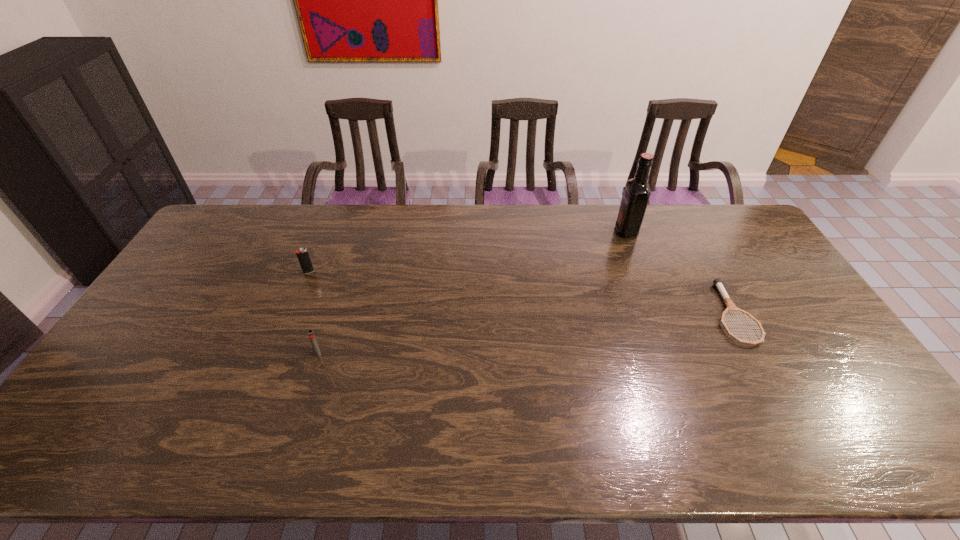
You are a GUI agent. You are given a task and a screenshot of the screen. Output one action in this format:
    pyautogui.click(x=<x>, y=<y>)
    Task: Click on the vacant space located on the front-facing side of the liquor
    The image size is (960, 540).
    Given the screenshot: What is the action you would take?
    pyautogui.click(x=555, y=231)

Find the location of `free region located 0.370m on the back of the farther igniter`. free region located 0.370m on the back of the farther igniter is located at coordinates (336, 205).

This screenshot has height=540, width=960. Identify the location of vacant space located on the left of the nearer igniter. (290, 353).

In order to click on free space located 0.090m on the left of the rightmost object in this screenshot , I will do `click(683, 314)`.

The height and width of the screenshot is (540, 960). I want to click on object that is positioned at the far edge, so click(x=637, y=192).

Find the location of a particular element. The height and width of the screenshot is (540, 960). vacant space at the far edge of the desktop is located at coordinates (444, 223).

This screenshot has height=540, width=960. Find the location of `vacant space at the near edge of the desktop`. vacant space at the near edge of the desktop is located at coordinates (380, 441).

The height and width of the screenshot is (540, 960). In the image, there is a desktop. In order to click on vacant space at the left edge in this screenshot , I will do `click(203, 281)`.

Where is `vacant space at the right edge of the desktop`? vacant space at the right edge of the desktop is located at coordinates (743, 249).

This screenshot has height=540, width=960. What are the coordinates of `vacant region at the far left corner of the desktop` in the screenshot? It's located at (228, 231).